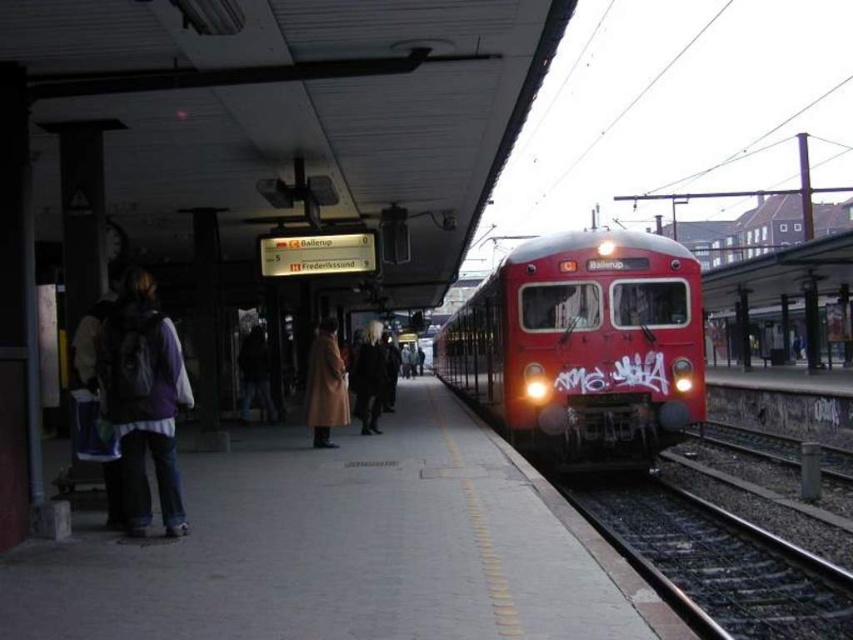
Question: Does concrete platform at center come in front of light brown leather coat at center?

Choices:
 (A) yes
 (B) no

Answer: (A)

Question: Among these points, which one is farthest from the camera?

Choices:
 (A) (328, 483)
 (B) (543, 403)
 (C) (369, 401)
 (D) (340, 360)

Answer: (C)

Question: Does red glossy train at center lie behind light brown leather coat at center?

Choices:
 (A) no
 (B) yes

Answer: (A)

Question: Which point is farther to the camera?

Choices:
 (A) (386, 371)
 (B) (412, 493)

Answer: (A)

Question: Which object is the farthest from the red glossy train at center?

Choices:
 (A) concrete platform at center
 (B) light brown leather coat at center
 (C) dark brown leather coat at center

Answer: (B)

Question: Is concrete platform at center thinner than dark brown leather coat at center?

Choices:
 (A) yes
 (B) no

Answer: (B)